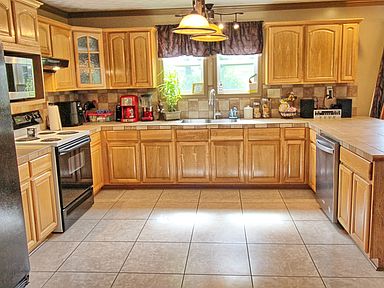
You are a GUI agent. You are given a task and a screenshot of the screen. Output one action in this format:
    pyautogui.click(x=<x>, y=<y>)
    Task: Click on the blender
    
    Given the screenshot: What is the action you would take?
    pyautogui.click(x=147, y=106)